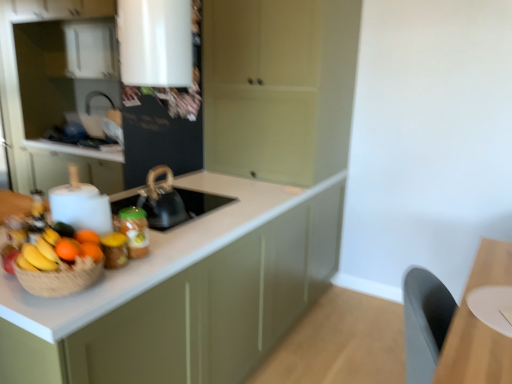
Question: Does orange matte at left, arranged as the second orange when viewed from the back, have a lesser width compared to matte green cabinet at center, acting as the 1th cabinetry starting from the right?

Choices:
 (A) no
 (B) yes

Answer: (B)

Question: From the image's perspective, is orange matte at left, the 2th orange when ordered from front to back, over matte green cabinet at center, acting as the 1th cabinetry starting from the right?

Choices:
 (A) yes
 (B) no

Answer: (B)

Question: Is orange matte at left, arranged as the second orange when viewed from the back, wider than matte green cabinet at center, the third cabinetry positioned from the left?

Choices:
 (A) yes
 (B) no

Answer: (B)

Question: Is matte green cabinet at center, acting as the 1th cabinetry starting from the right, at the back of orange matte at left, the 2th orange when ordered from front to back?

Choices:
 (A) yes
 (B) no

Answer: (B)

Question: Is orange matte at left, the 2th orange when ordered from front to back, shorter than matte green cabinet at center, acting as the 1th cabinetry starting from the right?

Choices:
 (A) yes
 (B) no

Answer: (A)

Question: From a real-world perspective, is yellow matte bananas at left physically located above or below white matte cabinet at left, which ranks as the 3th cabinetry in right-to-left order?

Choices:
 (A) above
 (B) below

Answer: (B)

Question: Does point pyautogui.click(x=13, y=248) appear closer or farther from the camera than point pyautogui.click(x=97, y=155)?

Choices:
 (A) closer
 (B) farther

Answer: (A)

Question: Which is correct: yellow matte bananas at left is inside white matte cabinet at left, placed as the first cabinetry when sorted from left to right, or outside of it?

Choices:
 (A) inside
 (B) outside

Answer: (B)

Question: Is yellow matte bananas at left in front of or behind white matte cabinet at left, placed as the first cabinetry when sorted from left to right, in the image?

Choices:
 (A) behind
 (B) front

Answer: (B)

Question: Based on their positions, is orange matte at left, acting as the third orange starting from the back, located to the left or right of white matte cabinet at left, placed as the first cabinetry when sorted from left to right?

Choices:
 (A) right
 (B) left

Answer: (A)

Question: In terms of height, does orange matte at left, acting as the third orange starting from the back, look taller or shorter compared to white matte cabinet at left, placed as the first cabinetry when sorted from left to right?

Choices:
 (A) short
 (B) tall

Answer: (A)

Question: In terms of width, does orange matte at left, the 1th orange from the front, look wider or thinner when compared to white matte cabinet at left, placed as the first cabinetry when sorted from left to right?

Choices:
 (A) thin
 (B) wide

Answer: (A)

Question: Looking at the image, does orange matte at left, acting as the third orange starting from the back, seem bigger or smaller compared to white matte cabinet at left, placed as the first cabinetry when sorted from left to right?

Choices:
 (A) small
 (B) big

Answer: (A)

Question: Considering the positions of matte white countertop at center, arranged as the second cabinetry when viewed from the right, and matte green cabinet at center, acting as the 1th cabinetry starting from the right, in the image, is matte white countertop at center, arranged as the second cabinetry when viewed from the right, bigger or smaller than matte green cabinet at center, acting as the 1th cabinetry starting from the right,?

Choices:
 (A) big
 (B) small

Answer: (B)

Question: Is matte white countertop at center, arranged as the second cabinetry when viewed from the right, wider or thinner than matte green cabinet at center, acting as the 1th cabinetry starting from the right?

Choices:
 (A) thin
 (B) wide

Answer: (B)